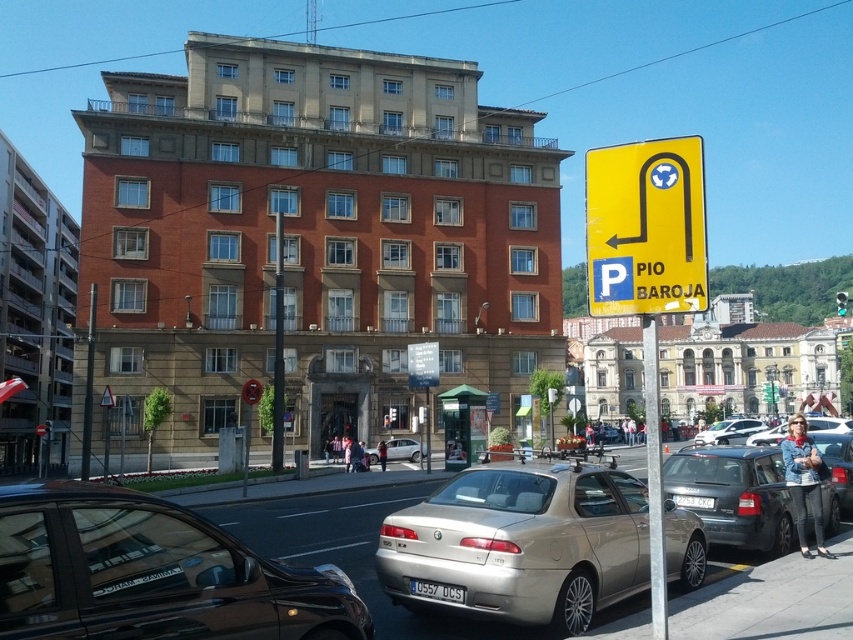
Who is more distant from viewer, [136,636] or [654,518]?

The point [654,518] is behind.

Does shiny black sedan at lower left have a lesser width compared to metallic pole at right?

Correct, shiny black sedan at lower left's width is less than metallic pole at right's.

Find the location of `shiny black sedan at lower left`. shiny black sedan at lower left is located at coordinates (152, 573).

Image resolution: width=853 pixels, height=640 pixels. What are the coordinates of `shiny black sedan at lower left` in the screenshot? It's located at click(x=152, y=573).

Is point (813, 541) farther from viewer compared to point (654, 401)?

That is True.

Is point (837, 529) closer to viewer compared to point (648, 452)?

No, (837, 529) is further to viewer.

In order to click on metallic gray hatchback at center in this screenshot , I will do `click(734, 496)`.

Can you confirm if gold metallic sedan at center is taller than yellow plastic parking sign at upper right?

No, gold metallic sedan at center is not taller than yellow plastic parking sign at upper right.

Can you confirm if gold metallic sedan at center is smaller than yellow plastic parking sign at upper right?

Yes.

Where is `gold metallic sedan at center`? This screenshot has width=853, height=640. gold metallic sedan at center is located at coordinates (520, 545).